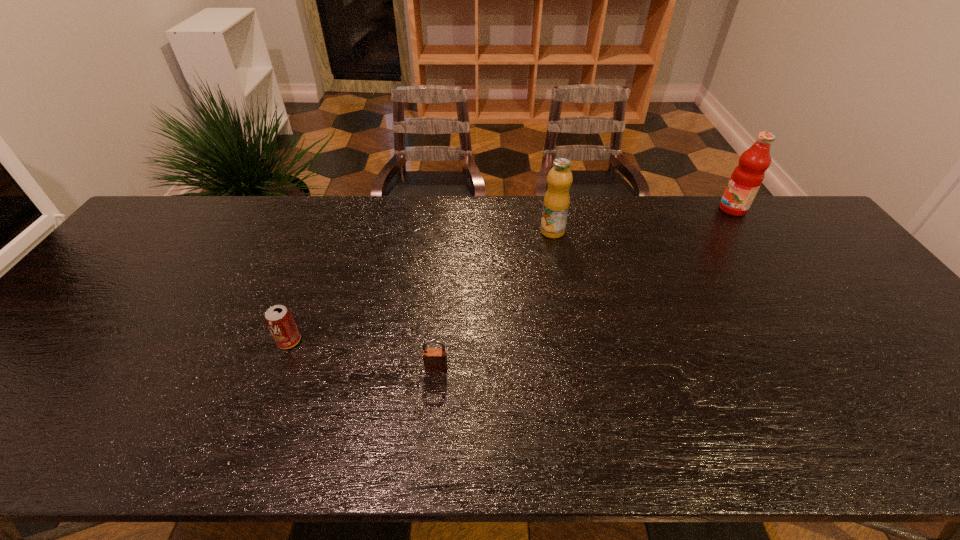
This screenshot has width=960, height=540. I want to click on object that is the closest to the second farthest object, so click(x=435, y=359).

Identify which object is located as the second nearest to the right fruit juice. Please provide its 2D coordinates. Your answer should be formatted as a tuple, i.e. [(x, y)], where the tuple contains the x and y coordinates of a point satisfying the conditions above.

[(435, 359)]

The height and width of the screenshot is (540, 960). I want to click on vacant area in the image that satisfies the following two spatial constraints: 1. on the front label of the farthest object; 2. on the front side of the second nearest object, so click(x=826, y=341).

This screenshot has height=540, width=960. I want to click on vacant position in the image that satisfies the following two spatial constraints: 1. on the front label of the right fruit juice; 2. on the front side of the leftmost object, so 826,341.

Identify the location of free spot that satisfies the following two spatial constraints: 1. on the front label of the rightmost object; 2. on the front side of the second nearest object. The height and width of the screenshot is (540, 960). (826, 341).

Where is `vacant space that satisfies the following two spatial constraints: 1. on the front label of the rightmost object; 2. on the front label of the left fruit juice`? The image size is (960, 540). vacant space that satisfies the following two spatial constraints: 1. on the front label of the rightmost object; 2. on the front label of the left fruit juice is located at coordinates (748, 231).